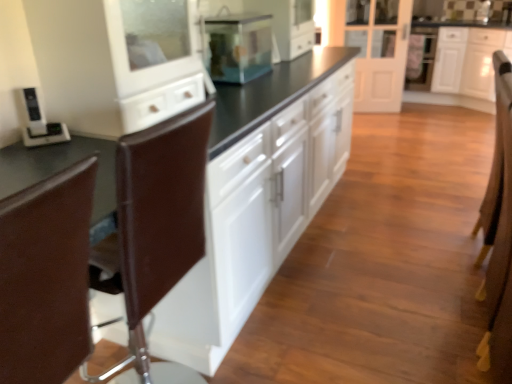
In order to click on vacant space that is to the left of brown leather armchair at right in this screenshot , I will do `click(425, 252)`.